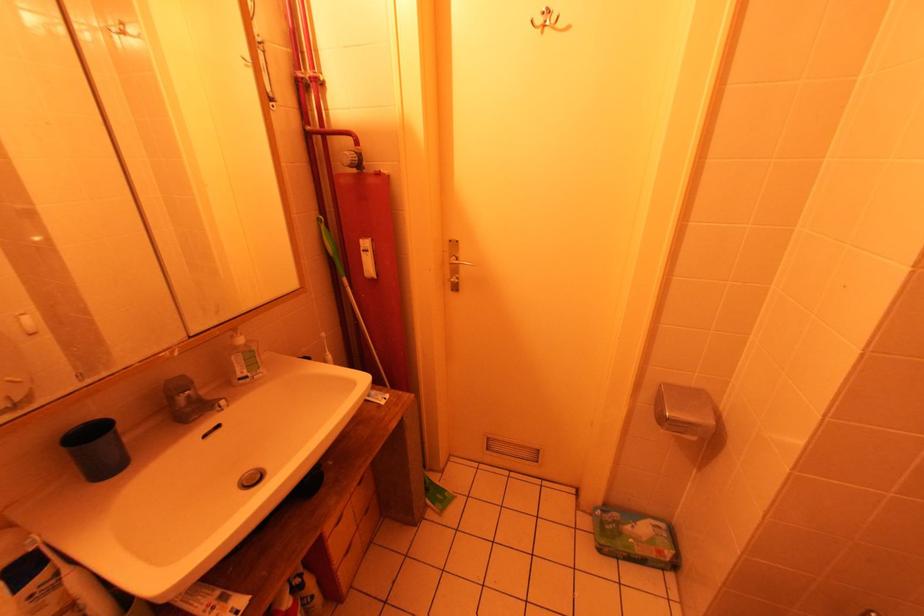
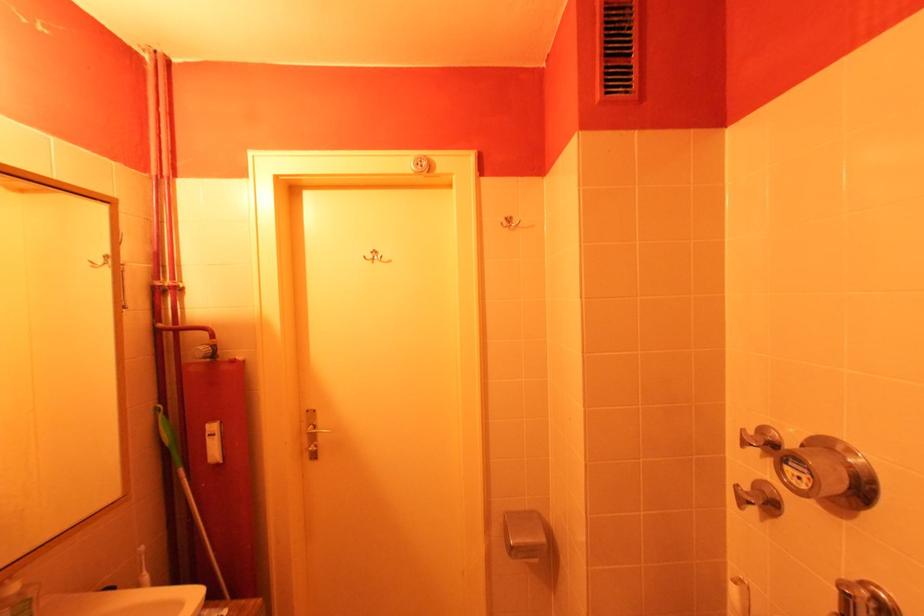
The images are taken continuously from a first-person perspective. In which direction is your viewpoint rotating?

The camera rotated toward right-up.